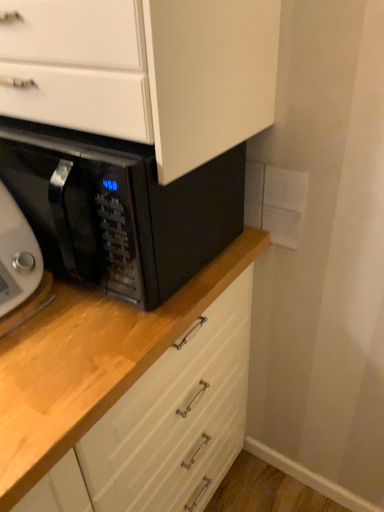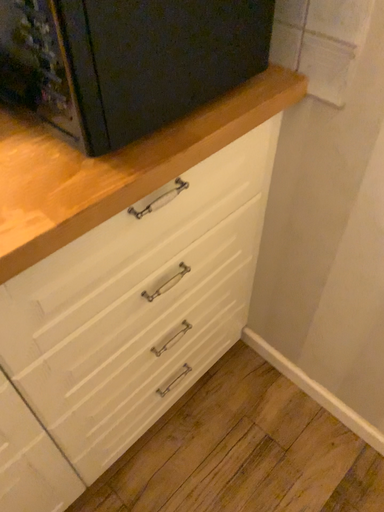
Question: Which way did the camera rotate in the video?

Choices:
 (A) rotated downward
 (B) rotated upward

Answer: (A)